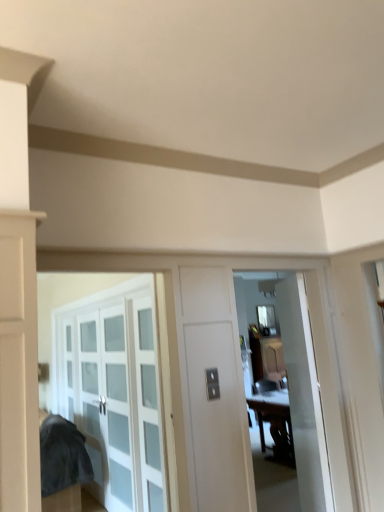
Question: Can you confirm if white glossy door at center is wider than clear glass cabinet at left?

Choices:
 (A) no
 (B) yes

Answer: (A)

Question: Does white glossy door at center have a lesser width compared to clear glass cabinet at left?

Choices:
 (A) no
 (B) yes

Answer: (B)

Question: Is white glossy door at center aimed at clear glass cabinet at left?

Choices:
 (A) no
 (B) yes

Answer: (A)

Question: Is white glossy door at center looking in the opposite direction of clear glass cabinet at left?

Choices:
 (A) yes
 (B) no

Answer: (B)

Question: Is white glossy door at center to the left of clear glass cabinet at left from the viewer's perspective?

Choices:
 (A) yes
 (B) no

Answer: (B)

Question: Does white glossy door at center have a lesser height compared to clear glass cabinet at left?

Choices:
 (A) yes
 (B) no

Answer: (B)

Question: Can you confirm if white glossy door at center is bigger than clear glass window at center?

Choices:
 (A) yes
 (B) no

Answer: (A)

Question: Would you say white glossy door at center is outside clear glass window at center?

Choices:
 (A) no
 (B) yes

Answer: (B)

Question: Is white glossy door at center aimed at clear glass window at center?

Choices:
 (A) yes
 (B) no

Answer: (B)

Question: Is white glossy door at center thinner than clear glass window at center?

Choices:
 (A) no
 (B) yes

Answer: (A)

Question: Does white glossy door at center contain clear glass window at center?

Choices:
 (A) yes
 (B) no

Answer: (B)

Question: Does white glossy door at center have a lesser height compared to clear glass window at center?

Choices:
 (A) yes
 (B) no

Answer: (B)

Question: Considering the relative positions of wooden table at center and white glossy door at center in the image provided, is wooden table at center to the left of white glossy door at center from the viewer's perspective?

Choices:
 (A) no
 (B) yes

Answer: (A)